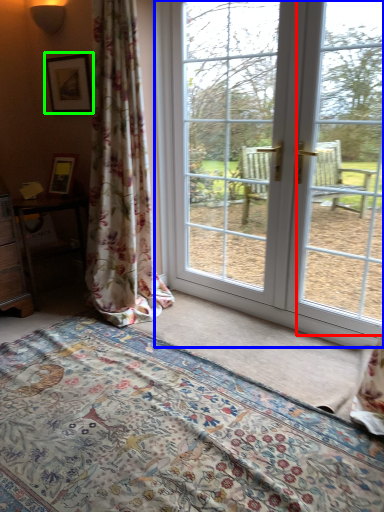
Question: Which object is the farthest from window screen (highlighted by a red box)? Choose among these: door (highlighted by a blue box) or picture frame (highlighted by a green box).

Choices:
 (A) door
 (B) picture frame

Answer: (B)